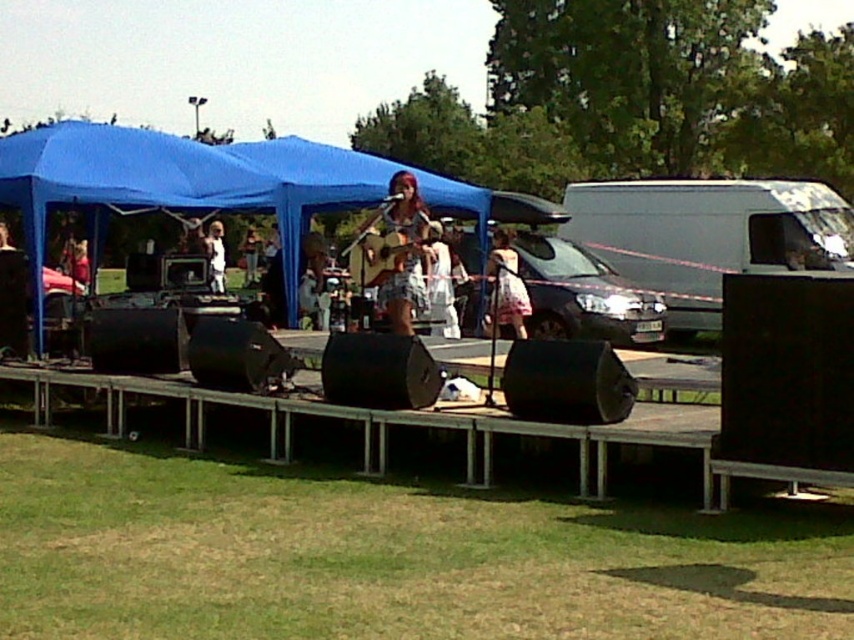
Question: Which point is farther to the camera?

Choices:
 (A) (387, 308)
 (B) (512, 310)

Answer: (B)

Question: In this image, where is white cotton dress at center located relative to white fabric dress at center?

Choices:
 (A) above
 (B) below

Answer: (B)

Question: Can you confirm if white floral dress at center is bigger than white cotton dress at center?

Choices:
 (A) no
 (B) yes

Answer: (B)

Question: Is matte brown guitar at center above light brown wooden guitar at center?

Choices:
 (A) yes
 (B) no

Answer: (B)

Question: Among these objects, which one is farthest from the camera?

Choices:
 (A) white floral dress at center
 (B) white matte van at right

Answer: (B)

Question: Which object is the farthest from the matte brown guitar at center?

Choices:
 (A) blue fabric tent at center
 (B) white matte van at right

Answer: (B)